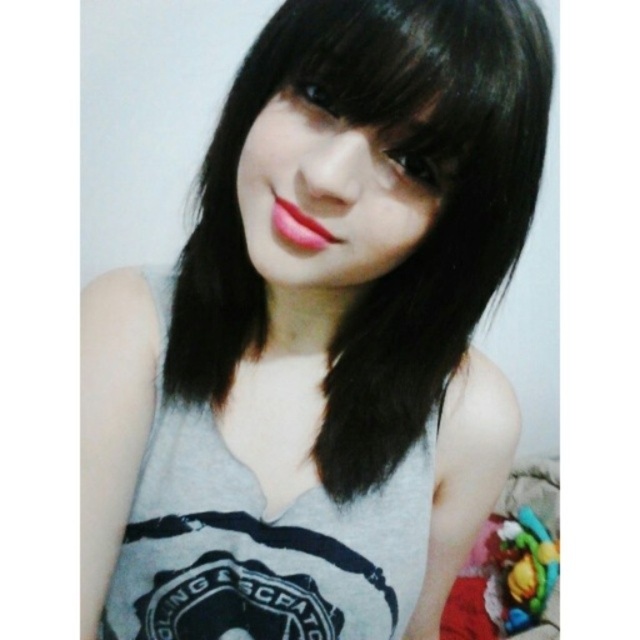
You are a stylist preparing to take a photo of a model wearing a gray matte tank top at center and applying matte pink lipstick at center. Based on the scene description, which object is positioned to the right of the other?

The gray matte tank top at center is to the right of the matte pink lipstick at center.